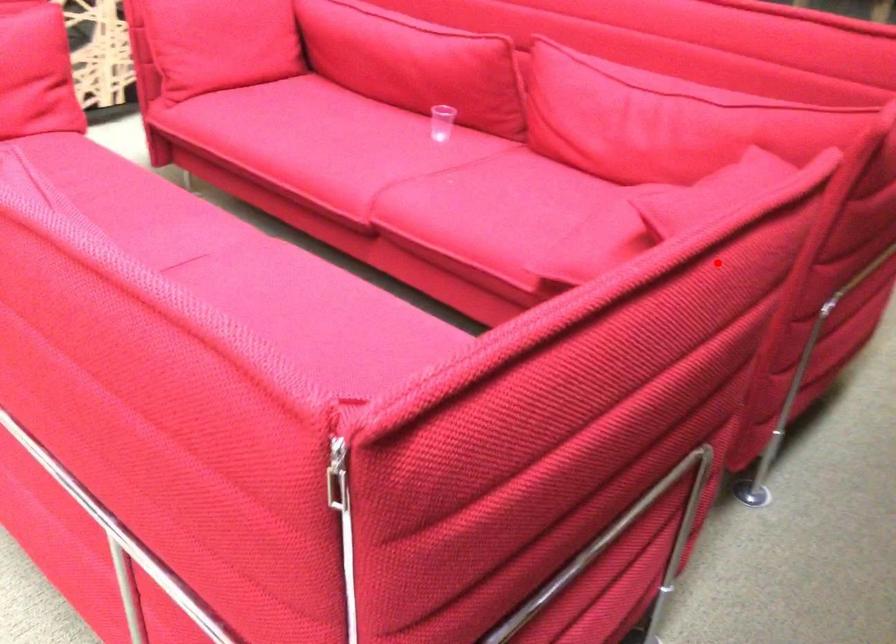
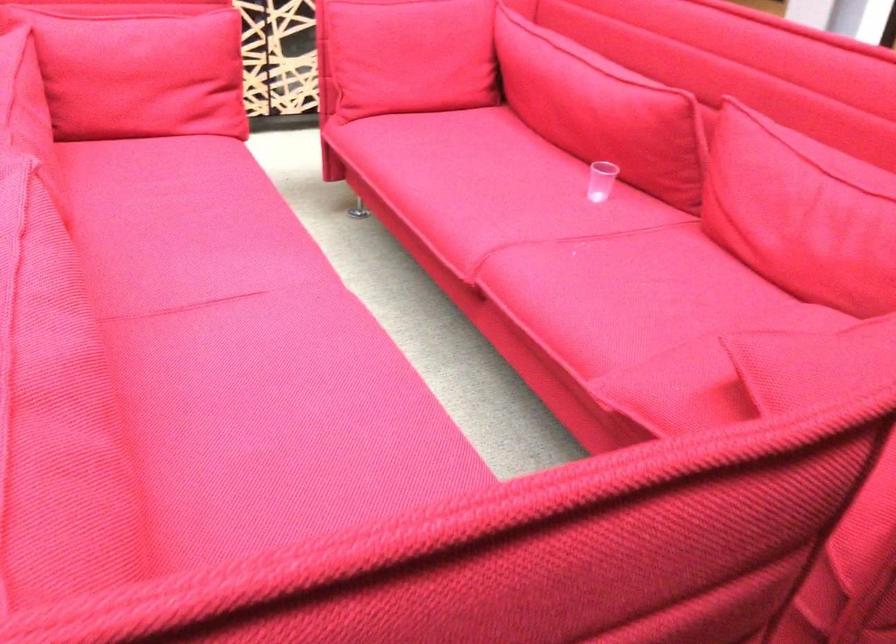
Where in the second image is the point corresponding to the highlighted location from the first image?

(581, 542)